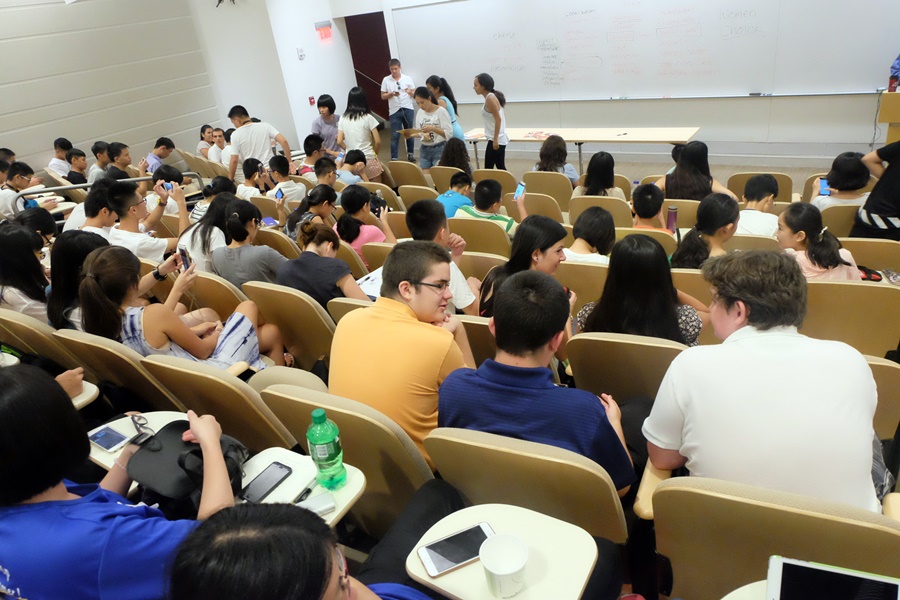
Where is `handrail`? handrail is located at coordinates (73, 186).